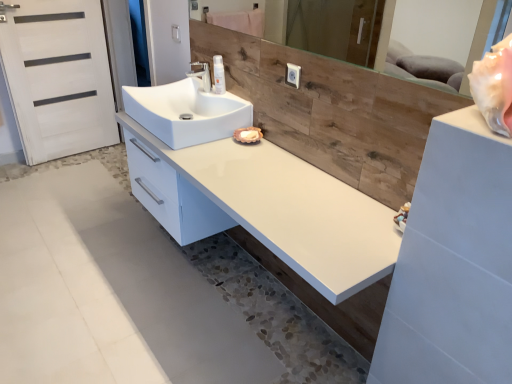
Question: Would you say white matte door at left is outside white glossy sink at center?

Choices:
 (A) yes
 (B) no

Answer: (A)

Question: Is white matte door at left facing away from white glossy sink at center?

Choices:
 (A) yes
 (B) no

Answer: (B)

Question: From a real-world perspective, does white matte door at left sit lower than white glossy sink at center?

Choices:
 (A) no
 (B) yes

Answer: (B)

Question: Can you confirm if white matte door at left is thinner than white glossy sink at center?

Choices:
 (A) yes
 (B) no

Answer: (A)

Question: Is white matte door at left bigger than white glossy sink at center?

Choices:
 (A) yes
 (B) no

Answer: (A)

Question: Is white matte door at left further to camera compared to white glossy sink at center?

Choices:
 (A) yes
 (B) no

Answer: (A)

Question: Is white glossy spray can at center closer to camera compared to white glossy counter at center?

Choices:
 (A) yes
 (B) no

Answer: (B)

Question: Is white glossy spray can at center positioned with its back to white glossy counter at center?

Choices:
 (A) yes
 (B) no

Answer: (B)

Question: Is white glossy spray can at center positioned beyond the bounds of white glossy counter at center?

Choices:
 (A) yes
 (B) no

Answer: (A)

Question: Considering the relative positions of white glossy spray can at center and white glossy counter at center in the image provided, is white glossy spray can at center to the left of white glossy counter at center from the viewer's perspective?

Choices:
 (A) yes
 (B) no

Answer: (A)

Question: Is white glossy counter at center located within white glossy spray can at center?

Choices:
 (A) no
 (B) yes

Answer: (A)

Question: Considering the relative sizes of white glossy spray can at center and white glossy counter at center in the image provided, is white glossy spray can at center bigger than white glossy counter at center?

Choices:
 (A) yes
 (B) no

Answer: (B)

Question: From the image's perspective, is wooden mirror at upper center over white glossy counter at center?

Choices:
 (A) yes
 (B) no

Answer: (A)